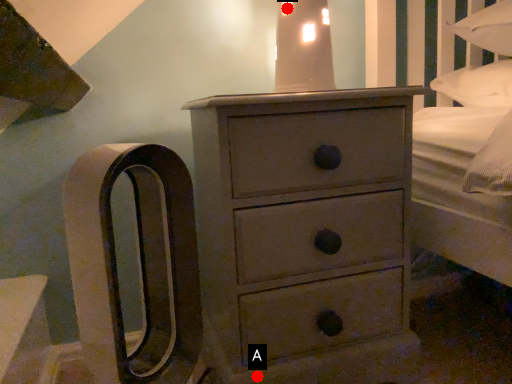
Question: Two points are circled on the image, labeled by A and B beside each circle. Which point is further to the camera?

Choices:
 (A) A is further
 (B) B is further

Answer: (B)